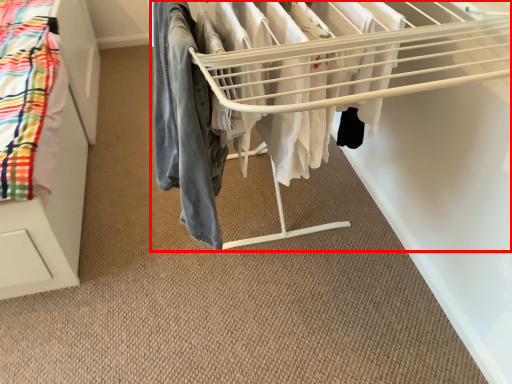
Question: In this image, where is bunk bed (annotated by the red box) located relative to clothing?

Choices:
 (A) right
 (B) left

Answer: (A)